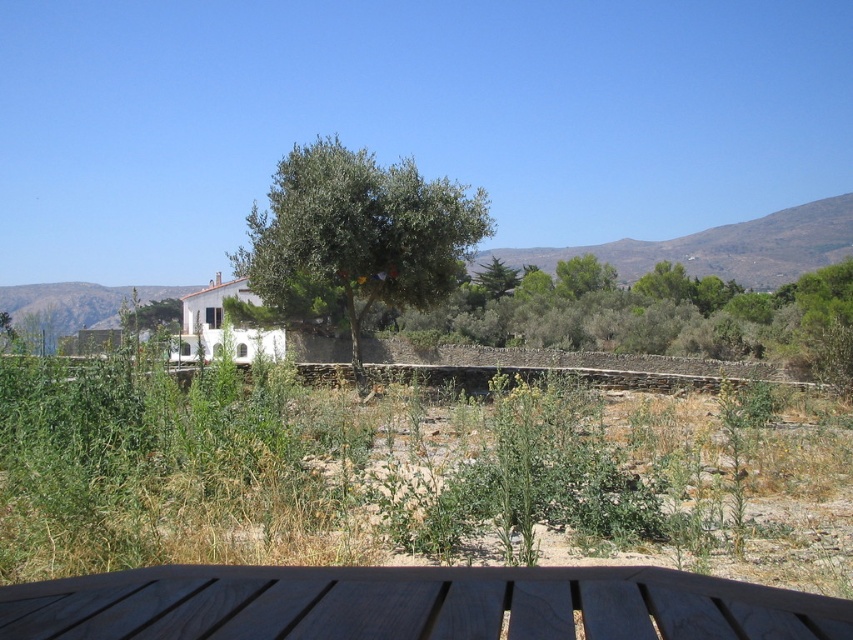
Question: Does wooden picnic table at lower center appear over green leafy olive tree at center?

Choices:
 (A) yes
 (B) no

Answer: (B)

Question: Which of the following is the closest to the observer?

Choices:
 (A) wooden picnic table at lower center
 (B) green leafy olive tree at center

Answer: (A)

Question: Considering the relative positions of wooden picnic table at lower center and green leafy olive tree at center in the image provided, where is wooden picnic table at lower center located with respect to green leafy olive tree at center?

Choices:
 (A) left
 (B) right

Answer: (B)

Question: Which of the following is the farthest from the observer?

Choices:
 (A) wooden picnic table at lower center
 (B) green leafy olive tree at center

Answer: (B)

Question: Is wooden picnic table at lower center closer to the viewer compared to green leafy olive tree at center?

Choices:
 (A) no
 (B) yes

Answer: (B)